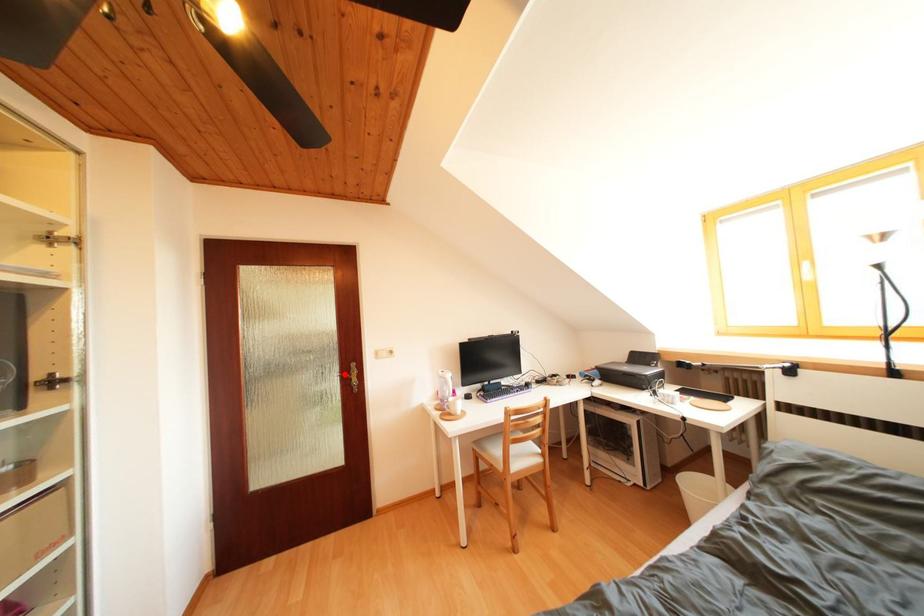
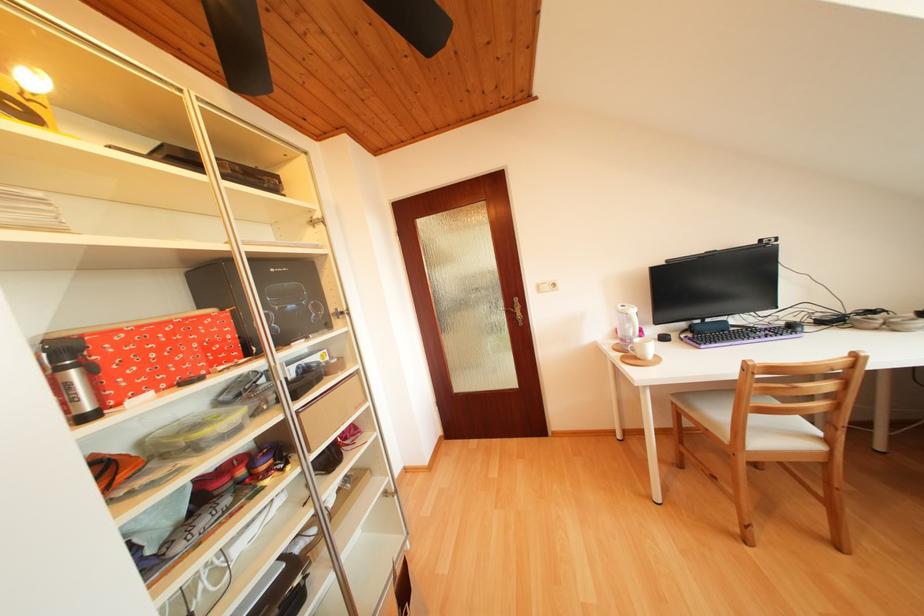
Where in the second image is the point corresponding to the highlighted location from the first image?

(509, 309)